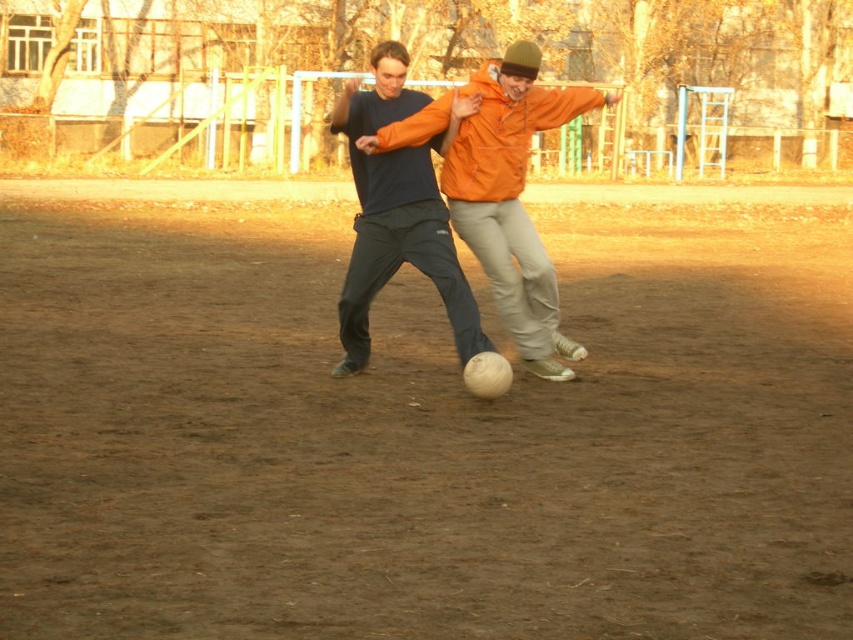
Is brown dirt field at center thinner than orange matte jacket at center?

No, brown dirt field at center is not thinner than orange matte jacket at center.

Between brown dirt field at center and orange matte jacket at center, which one is positioned lower?

brown dirt field at center is below.

Does point (570, 401) come behind point (492, 141)?

No, (570, 401) is in front of (492, 141).

This screenshot has width=853, height=640. Find the location of `brown dirt field at center`. brown dirt field at center is located at coordinates (416, 429).

Can you confirm if orange matte jacket at center is taller than matte black pants at center?

Yes, orange matte jacket at center is taller than matte black pants at center.

Who is positioned more to the right, orange matte jacket at center or matte black pants at center?

Positioned to the right is orange matte jacket at center.

The height and width of the screenshot is (640, 853). What do you see at coordinates (512, 196) in the screenshot?
I see `orange matte jacket at center` at bounding box center [512, 196].

I want to click on orange matte jacket at center, so click(512, 196).

Who is shorter, brown dirt field at center or matte black pants at center?

With less height is matte black pants at center.

Is brown dirt field at center above matte black pants at center?

No.

Does point (740, 572) come in front of point (373, 90)?

Yes.

Image resolution: width=853 pixels, height=640 pixels. In order to click on brown dirt field at center in this screenshot , I will do `click(416, 429)`.